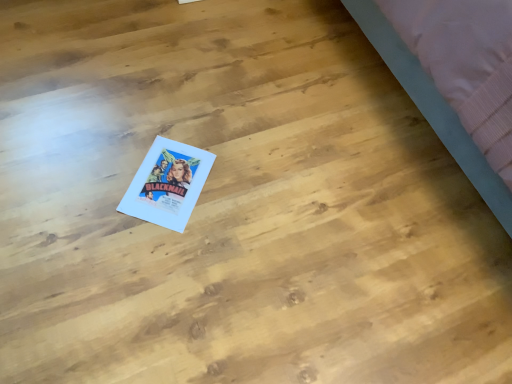
Find the location of a particular element. free space above white paper at center (from a real-world perspective) is located at coordinates (168, 172).